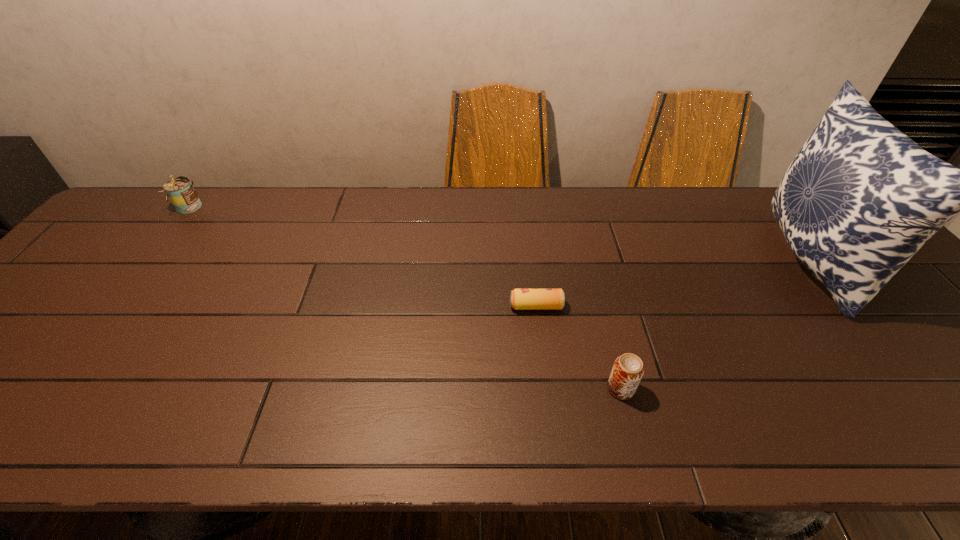
Locate an element on the screen. The image size is (960, 540). free space between the cushion and the can is located at coordinates click(x=499, y=234).

The height and width of the screenshot is (540, 960). Identify the location of empty space that is in between the farther beer can and the rightmost object. (673, 284).

The width and height of the screenshot is (960, 540). In order to click on free space between the farther beer can and the second tallest object in this screenshot , I will do `click(363, 257)`.

Locate which object ranks second in proximity to the rightmost object. Please provide its 2D coordinates. Your answer should be formatted as a tuple, i.e. [(x, y)], where the tuple contains the x and y coordinates of a point satisfying the conditions above.

[(520, 299)]

Locate which object ranks in proximity to the rightmost object. Please provide its 2D coordinates. Your answer should be formatted as a tuple, i.e. [(x, y)], where the tuple contains the x and y coordinates of a point satisfying the conditions above.

[(628, 369)]

At what (x,y) coordinates should I click in order to perform the action: click on free location that satisfies the following two spatial constraints: 1. on the front surface of the tallest object; 2. on the front side of the taller beer can. Please return your answer as a coordinate pair (x, y). This screenshot has width=960, height=540. Looking at the image, I should click on (908, 388).

At what (x,y) coordinates should I click in order to perform the action: click on free location that satisfies the following two spatial constraints: 1. on the front side of the leftmost object; 2. on the left side of the shorter beer can. Please return your answer as a coordinate pair (x, y). Image resolution: width=960 pixels, height=540 pixels. Looking at the image, I should click on (113, 306).

This screenshot has width=960, height=540. Find the location of `vacant area that satisfies the following two spatial constraints: 1. on the front side of the second shortest object; 2. on the left side of the shortest object`. vacant area that satisfies the following two spatial constraints: 1. on the front side of the second shortest object; 2. on the left side of the shortest object is located at coordinates (546, 388).